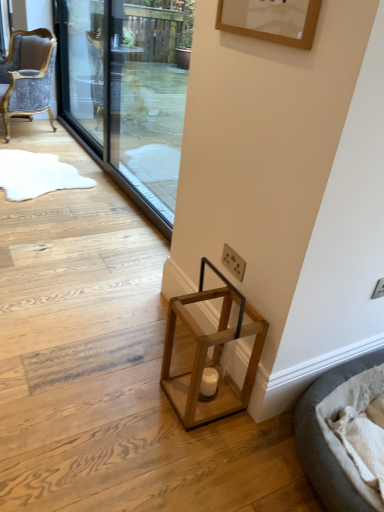
Question: Is transparent glass screen door at upper center, positioned as the first screen door in right-to-left order, outside of transparent glass screen door at upper left, the first screen door viewed from the left?

Choices:
 (A) yes
 (B) no

Answer: (A)

Question: Is transparent glass screen door at upper center, which is counted as the 2th screen door, starting from the left, wider than transparent glass screen door at upper left, the first screen door viewed from the left?

Choices:
 (A) yes
 (B) no

Answer: (A)

Question: Does transparent glass screen door at upper center, positioned as the first screen door in right-to-left order, lie behind transparent glass screen door at upper left, the first screen door viewed from the left?

Choices:
 (A) yes
 (B) no

Answer: (B)

Question: Considering the relative sizes of transparent glass screen door at upper center, positioned as the first screen door in right-to-left order, and transparent glass screen door at upper left, which is the second screen door from right to left, in the image provided, is transparent glass screen door at upper center, positioned as the first screen door in right-to-left order, shorter than transparent glass screen door at upper left, which is the second screen door from right to left,?

Choices:
 (A) yes
 (B) no

Answer: (B)

Question: Is transparent glass screen door at upper center, which is counted as the 2th screen door, starting from the left, oriented away from transparent glass screen door at upper left, the first screen door viewed from the left?

Choices:
 (A) yes
 (B) no

Answer: (B)

Question: From the image's perspective, does transparent glass screen door at upper center, positioned as the first screen door in right-to-left order, appear higher than transparent glass screen door at upper left, which is the second screen door from right to left?

Choices:
 (A) yes
 (B) no

Answer: (B)

Question: Can we say wooden lantern at lower center lies outside soft gray fabric cat bed at lower right?

Choices:
 (A) yes
 (B) no

Answer: (A)

Question: From a real-world perspective, is wooden lantern at lower center below soft gray fabric cat bed at lower right?

Choices:
 (A) no
 (B) yes

Answer: (B)

Question: From the image's perspective, would you say wooden lantern at lower center is shown under soft gray fabric cat bed at lower right?

Choices:
 (A) no
 (B) yes

Answer: (A)

Question: Does wooden lantern at lower center have a lesser width compared to soft gray fabric cat bed at lower right?

Choices:
 (A) yes
 (B) no

Answer: (A)

Question: Is wooden lantern at lower center further to the viewer compared to soft gray fabric cat bed at lower right?

Choices:
 (A) no
 (B) yes

Answer: (B)

Question: Can you confirm if wooden lantern at lower center is bigger than soft gray fabric cat bed at lower right?

Choices:
 (A) yes
 (B) no

Answer: (B)

Question: Is transparent glass screen door at upper center, which is counted as the 2th screen door, starting from the left, with soft gray fabric cat bed at lower right?

Choices:
 (A) yes
 (B) no

Answer: (B)